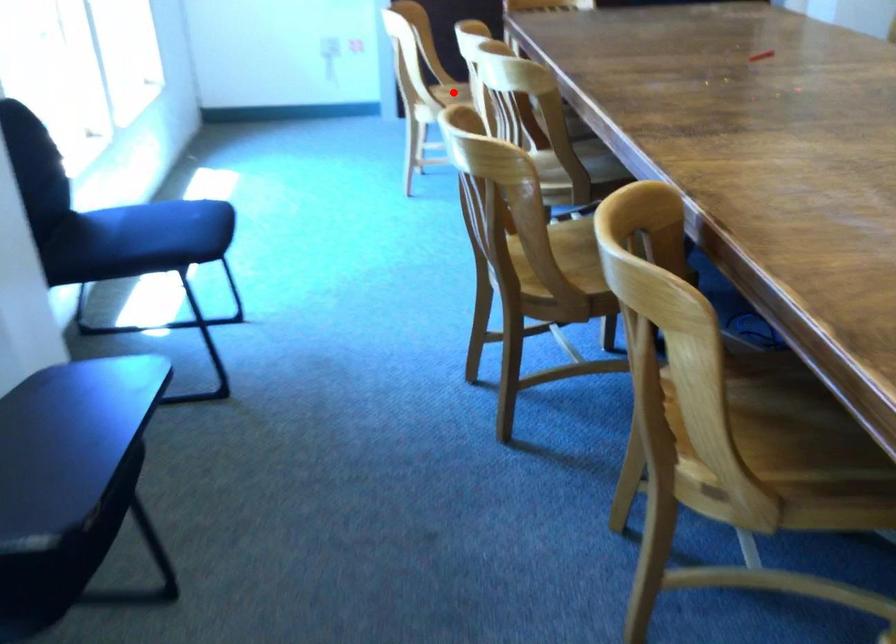
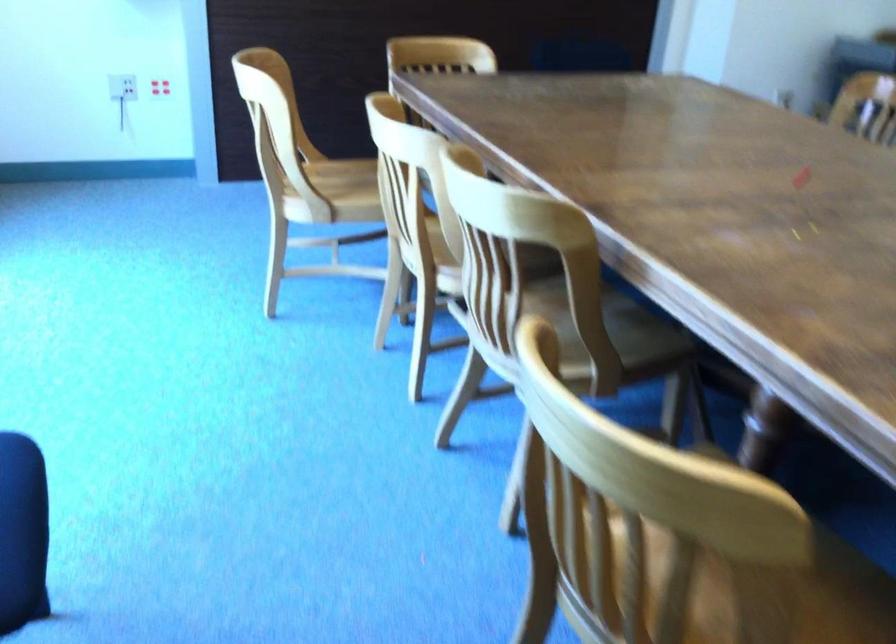
Locate, in the second image, the point that corresponds to the highlighted location in the first image.

(347, 180)